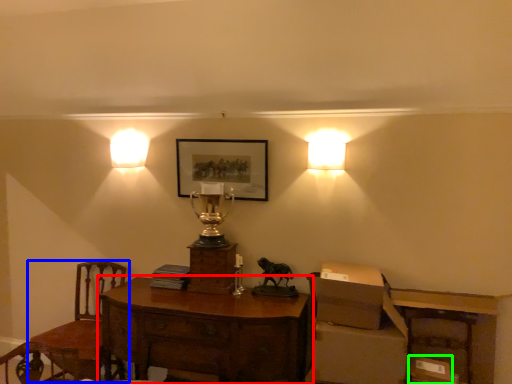
Question: Estimate the real-world distances between objects in this image. Which object is farther from desk (highlighted by a red box), chair (highlighted by a blue box) or cardboard box (highlighted by a green box)?

Choices:
 (A) chair
 (B) cardboard box

Answer: (B)